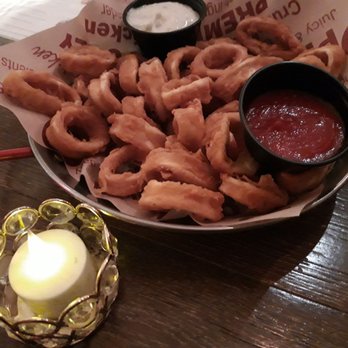
Where is `candle`? This screenshot has height=348, width=348. candle is located at coordinates (76, 264).